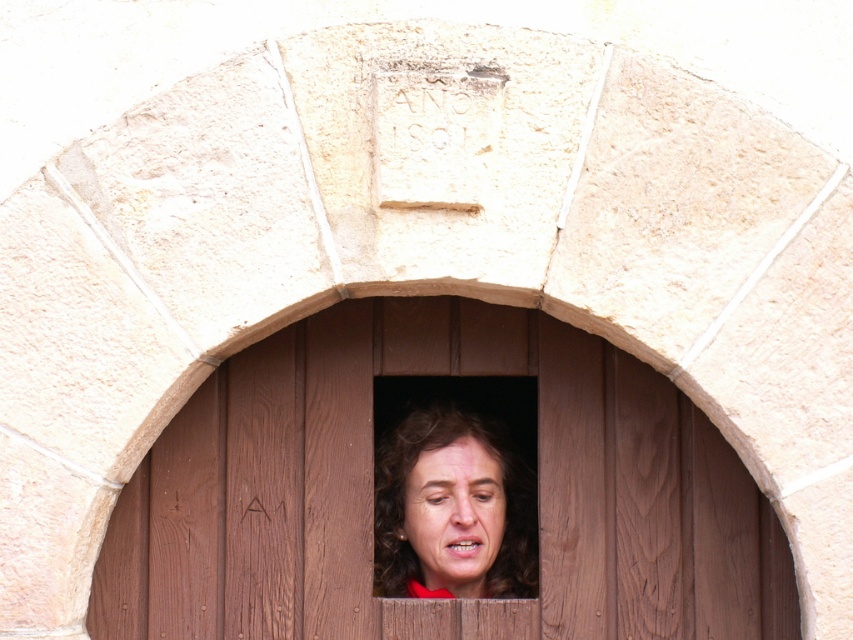
Can you confirm if brown wooden window at center is positioned to the right of curly brown hair at center?

Incorrect, brown wooden window at center is not on the right side of curly brown hair at center.

Is brown wooden window at center further to the viewer compared to curly brown hair at center?

No, it is in front of curly brown hair at center.

Is point (280, 515) behind point (535, 582)?

No, it is not.

Locate an element on the screen. The width and height of the screenshot is (853, 640). brown wooden window at center is located at coordinates (370, 490).

Between point (647, 371) and point (486, 497), which one is positioned in front?

Point (647, 371) is in front.

Which of these two, brown wooden window at center or smooth skin face at center, stands shorter?

Standing shorter between the two is smooth skin face at center.

The width and height of the screenshot is (853, 640). In order to click on brown wooden window at center in this screenshot , I will do `click(370, 490)`.

Who is lower down, curly brown hair at center or smooth skin face at center?

smooth skin face at center

In the scene shown: Does curly brown hair at center come in front of smooth skin face at center?

That is False.

Identify the location of curly brown hair at center. (451, 508).